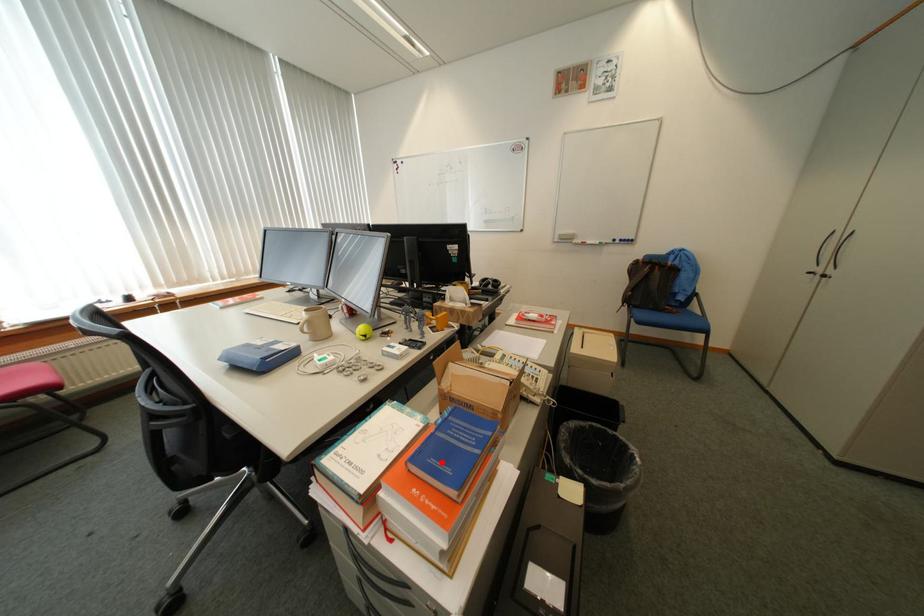
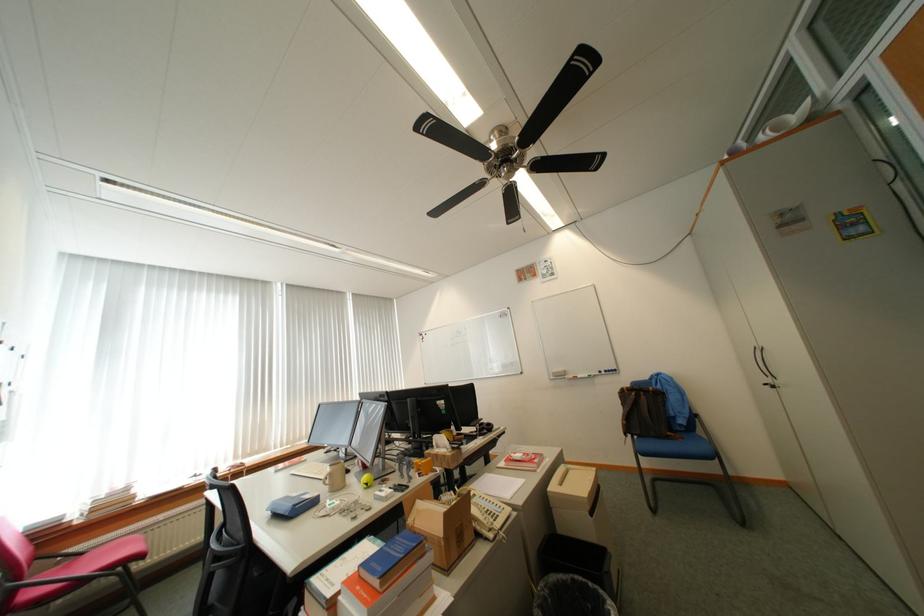
In the second image, find the point that corresponds to the highlighted location in the first image.

(383, 565)